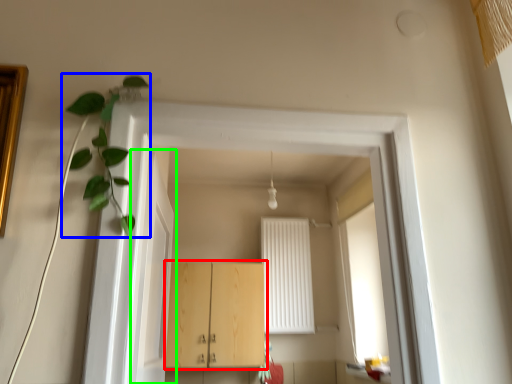
Question: Which object is positioned closest to cabinetry (highlighted by a red box)? Select from plant (highlighted by a blue box) and door (highlighted by a green box).

Choices:
 (A) plant
 (B) door

Answer: (B)